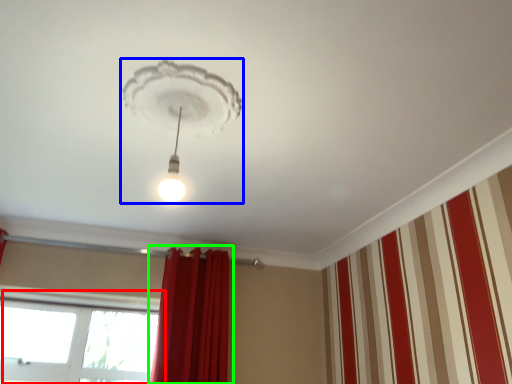
Question: Which is farther away from window (highlighted by a red box)? lamp (highlighted by a blue box) or curtain (highlighted by a green box)?

Choices:
 (A) lamp
 (B) curtain

Answer: (A)